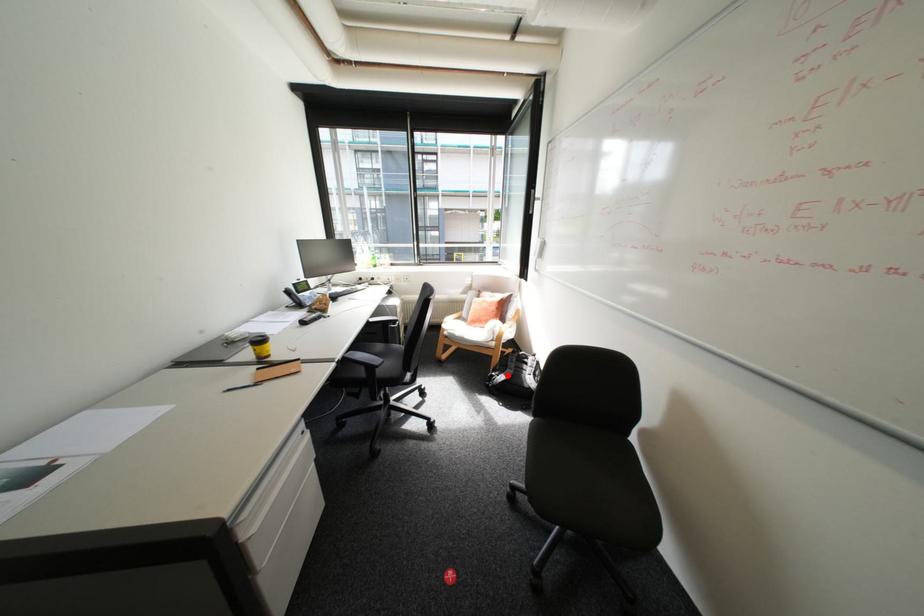
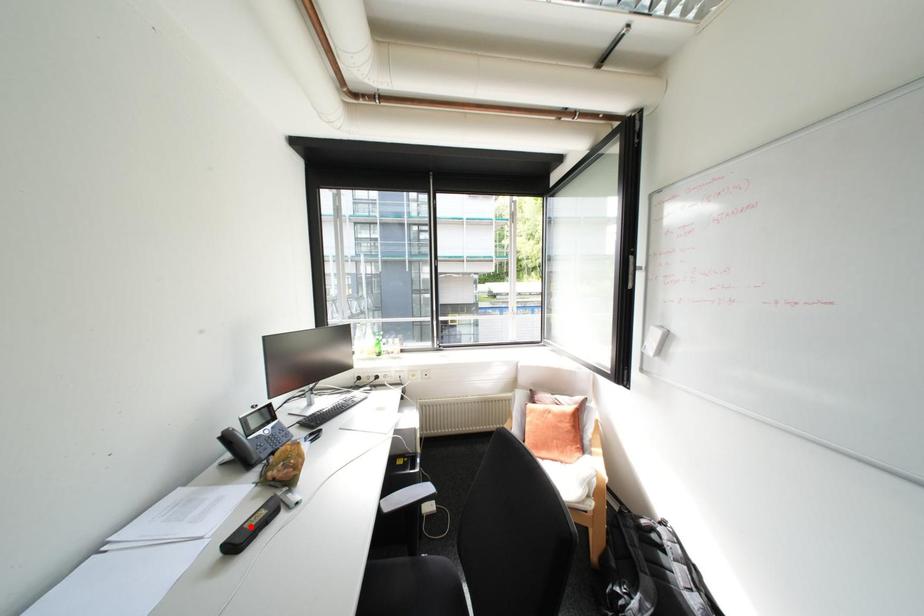
I am providing you with two images of the same scene from different viewpoints. A red point is marked on the first image and another point is marked on the second image. Is the marked point in image1 the same physical position as the marked point in image2?

No